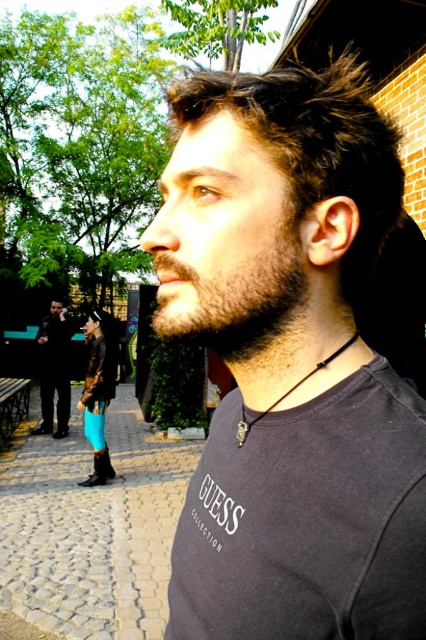
Can you confirm if matte black shirt at center is smaller than dark gray fleece sweatshirt at lower left?

Yes.

Does matte black shirt at center have a greater width compared to dark gray fleece sweatshirt at lower left?

No, matte black shirt at center is not wider than dark gray fleece sweatshirt at lower left.

What do you see at coordinates (290, 362) in the screenshot? This screenshot has height=640, width=426. I see `matte black shirt at center` at bounding box center [290, 362].

Locate an element on the screen. Image resolution: width=426 pixels, height=640 pixels. matte black shirt at center is located at coordinates (290, 362).

Looking at this image, does black leather jacket at left have a greater width compared to dark gray fleece sweatshirt at lower left?

Yes.

Is point (43, 365) farther from camera compared to point (100, 401)?

Yes, point (43, 365) is farther from viewer.

Describe the element at coordinates (54, 369) in the screenshot. I see `black leather jacket at left` at that location.

Where is `black leather jacket at left`? The width and height of the screenshot is (426, 640). black leather jacket at left is located at coordinates (54, 369).

Who is taller, matte black shirt at center or black leather jacket at left?

black leather jacket at left

Which is behind, point (371, 102) or point (32, 435)?

The point (32, 435) is more distant.

Locate an element on the screen. The height and width of the screenshot is (640, 426). matte black shirt at center is located at coordinates (290, 362).